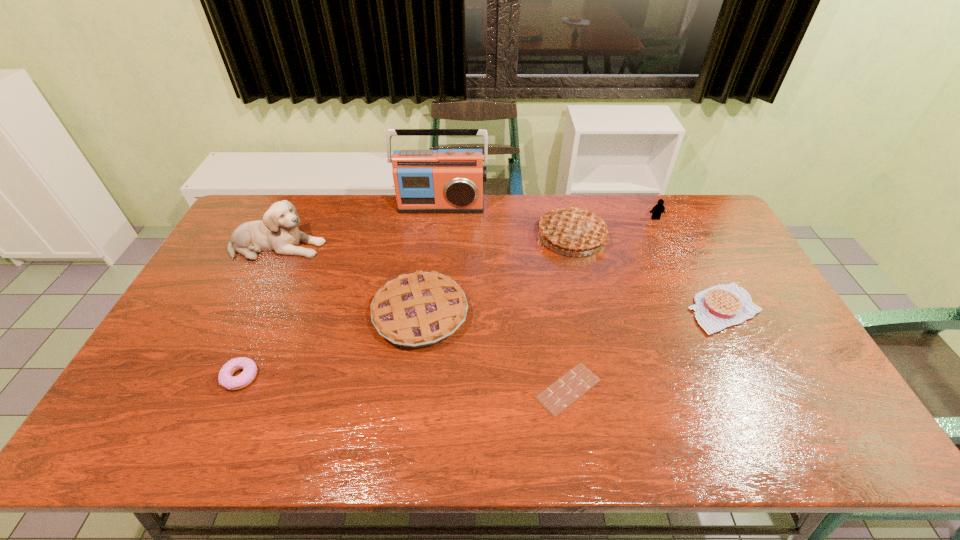
You are a GUI agent. You are given a task and a screenshot of the screen. Output one action in this format:
    pyautogui.click(x=<x>, y=<y>)
    Task: Click on the vacant area that lies between the fourth tallest object and the second tallest pie
    The width and height of the screenshot is (960, 540).
    Given the screenshot: What is the action you would take?
    pyautogui.click(x=538, y=267)

The width and height of the screenshot is (960, 540). I want to click on empty space between the shortest pie and the second pie from left to right, so click(648, 273).

The width and height of the screenshot is (960, 540). Find the location of `free space between the second shortest pie and the tallest pie`. free space between the second shortest pie and the tallest pie is located at coordinates (496, 275).

Find the location of a particular element. free space between the fourth tallest object and the rightmost pie is located at coordinates (689, 264).

Where is `unoccupied area between the radio receiver and the leftmost pie`? Image resolution: width=960 pixels, height=540 pixels. unoccupied area between the radio receiver and the leftmost pie is located at coordinates (431, 260).

The height and width of the screenshot is (540, 960). Identify the location of blank region between the puppy and the fourth tallest object. (467, 232).

The width and height of the screenshot is (960, 540). I want to click on free area in between the farthest pie and the fifth shortest object, so click(613, 227).

Identify the location of empty space that is in between the shortest pie and the chocolate bar. (646, 349).

Identify the location of free point between the shortest pie and the doughnut. (482, 343).

Where is `object that is the second closest one to the chocolate bar`? This screenshot has height=540, width=960. object that is the second closest one to the chocolate bar is located at coordinates (723, 305).